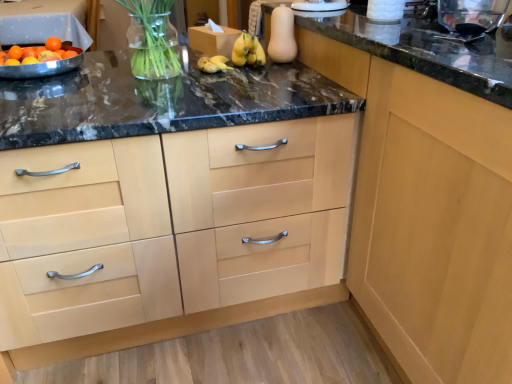
What do you see at coordinates (194, 242) in the screenshot? I see `light wood cabinet at center, marked as the first cabinetry in a left-to-right arrangement` at bounding box center [194, 242].

I want to click on orange matte at upper left, so click(x=53, y=44).

Consider the image. Would you say light wood cabinet at center, which is counted as the 1th cabinetry, starting from the right, is to the left or to the right of light wood cabinet at center, marked as the first cabinetry in a left-to-right arrangement, in the picture?

In the image, light wood cabinet at center, which is counted as the 1th cabinetry, starting from the right, appears on the right side of light wood cabinet at center, marked as the first cabinetry in a left-to-right arrangement.

Based on the photo, which object is more forward, light wood cabinet at center, the 2th cabinetry viewed from the left, or light wood cabinet at center, positioned as the second cabinetry in right-to-left order?

light wood cabinet at center, the 2th cabinetry viewed from the left.

The image size is (512, 384). I want to click on cabinetry above the light wood cabinet at center, marked as the first cabinetry in a left-to-right arrangement (from a real-world perspective), so click(428, 217).

Based on the photo, is light wood cabinet at center, which is counted as the 1th cabinetry, starting from the right, directly adjacent to light wood cabinet at center, marked as the first cabinetry in a left-to-right arrangement?

No, light wood cabinet at center, which is counted as the 1th cabinetry, starting from the right, is not touching light wood cabinet at center, marked as the first cabinetry in a left-to-right arrangement.

Which point is more distant from viewer, (206, 317) or (52, 44)?

The point (52, 44) is more distant.

Can you confirm if light wood cabinet at center, positioned as the second cabinetry in right-to-left order, is wider than orange matte at upper left?

Yes.

Which of these two, light wood cabinet at center, marked as the first cabinetry in a left-to-right arrangement, or orange matte at upper left, is smaller?

Smaller between the two is orange matte at upper left.

Find the location of `tangerine behind the light wood cabinet at center, which is counted as the 1th cabinetry, starting from the right`. tangerine behind the light wood cabinet at center, which is counted as the 1th cabinetry, starting from the right is located at coordinates (53, 44).

From the image's perspective, relative to light wood cabinet at center, which is counted as the 1th cabinetry, starting from the right, is orange matte at upper left above or below?

From the image's perspective, orange matte at upper left appears above light wood cabinet at center, which is counted as the 1th cabinetry, starting from the right.

Looking at this image, who is shorter, orange matte at upper left or light wood cabinet at center, the 2th cabinetry viewed from the left?

Standing shorter between the two is orange matte at upper left.

Which object is thinner, orange matte at upper left or light wood cabinet at center, which is counted as the 1th cabinetry, starting from the right?

Thinner between the two is orange matte at upper left.

Is orange matte at upper left thinner than light wood cabinet at center, marked as the first cabinetry in a left-to-right arrangement?

Yes.

Considering the sizes of objects orange matte at upper left and light wood cabinet at center, positioned as the second cabinetry in right-to-left order, in the image provided, who is bigger, orange matte at upper left or light wood cabinet at center, positioned as the second cabinetry in right-to-left order,?

With larger size is light wood cabinet at center, positioned as the second cabinetry in right-to-left order.

Which is more to the left, orange matte at upper left or light wood cabinet at center, marked as the first cabinetry in a left-to-right arrangement?

orange matte at upper left is more to the left.

Does light wood cabinet at center, positioned as the second cabinetry in right-to-left order, turn towards light wood cabinet at center, which is counted as the 1th cabinetry, starting from the right?

No, light wood cabinet at center, positioned as the second cabinetry in right-to-left order, is not oriented towards light wood cabinet at center, which is counted as the 1th cabinetry, starting from the right.

From the image's perspective, is light wood cabinet at center, positioned as the second cabinetry in right-to-left order, above or below light wood cabinet at center, the 2th cabinetry viewed from the left?

Based on their image positions, light wood cabinet at center, positioned as the second cabinetry in right-to-left order, is located beneath light wood cabinet at center, the 2th cabinetry viewed from the left.

Can you confirm if light wood cabinet at center, positioned as the second cabinetry in right-to-left order, is wider than light wood cabinet at center, which is counted as the 1th cabinetry, starting from the right?

Yes.

Which of these two, light wood cabinet at center, which is counted as the 1th cabinetry, starting from the right, or orange matte at upper left, is smaller?

orange matte at upper left.

Considering the relative positions of light wood cabinet at center, the 2th cabinetry viewed from the left, and orange matte at upper left in the image provided, is light wood cabinet at center, the 2th cabinetry viewed from the left, behind orange matte at upper left?

No, the depth of light wood cabinet at center, the 2th cabinetry viewed from the left, is less than that of orange matte at upper left.

The image size is (512, 384). I want to click on tangerine on the left of light wood cabinet at center, the 2th cabinetry viewed from the left, so click(53, 44).

Is light wood cabinet at center, which is counted as the 1th cabinetry, starting from the right, facing away from orange matte at upper left?

No, light wood cabinet at center, which is counted as the 1th cabinetry, starting from the right, is not facing away from orange matte at upper left.

Identify the location of cabinetry lying on the left of light wood cabinet at center, which is counted as the 1th cabinetry, starting from the right. (194, 242).

From a real-world perspective, count 2nd cabinetrys downward from the orange matte at upper left and point to it. Please provide its 2D coordinates.

[(194, 242)]

Which object lies nearer to the anchor point light wood cabinet at center, positioned as the second cabinetry in right-to-left order, light wood cabinet at center, the 2th cabinetry viewed from the left, or orange matte at upper left?

light wood cabinet at center, the 2th cabinetry viewed from the left, lies closer to light wood cabinet at center, positioned as the second cabinetry in right-to-left order, than the other object.

From the image, which object appears to be nearer to orange matte at upper left, light wood cabinet at center, which is counted as the 1th cabinetry, starting from the right, or light wood cabinet at center, marked as the first cabinetry in a left-to-right arrangement?

light wood cabinet at center, marked as the first cabinetry in a left-to-right arrangement, lies closer to orange matte at upper left than the other object.

From the image, which object appears to be nearer to light wood cabinet at center, the 2th cabinetry viewed from the left, orange matte at upper left or light wood cabinet at center, marked as the first cabinetry in a left-to-right arrangement?

Based on the image, light wood cabinet at center, marked as the first cabinetry in a left-to-right arrangement, appears to be nearer to light wood cabinet at center, the 2th cabinetry viewed from the left.

Considering their positions, is orange matte at upper left positioned closer to light wood cabinet at center, marked as the first cabinetry in a left-to-right arrangement, than light wood cabinet at center, the 2th cabinetry viewed from the left?

light wood cabinet at center, the 2th cabinetry viewed from the left.

When comparing their distances from light wood cabinet at center, which is counted as the 1th cabinetry, starting from the right, does light wood cabinet at center, positioned as the second cabinetry in right-to-left order, or orange matte at upper left seem further?

orange matte at upper left lies further to light wood cabinet at center, which is counted as the 1th cabinetry, starting from the right, than the other object.

In the scene shown: Looking at the image, which one is located further to orange matte at upper left, light wood cabinet at center, marked as the first cabinetry in a left-to-right arrangement, or light wood cabinet at center, which is counted as the 1th cabinetry, starting from the right?

light wood cabinet at center, which is counted as the 1th cabinetry, starting from the right.

Where is `cabinetry located between orange matte at upper left and light wood cabinet at center, the 2th cabinetry viewed from the left, in the left-right direction`? The width and height of the screenshot is (512, 384). cabinetry located between orange matte at upper left and light wood cabinet at center, the 2th cabinetry viewed from the left, in the left-right direction is located at coordinates (194, 242).